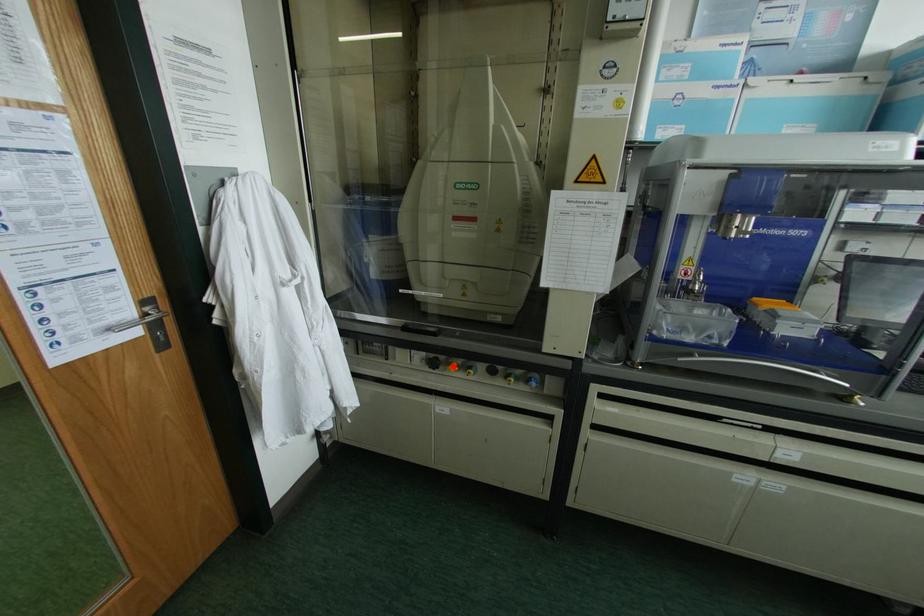
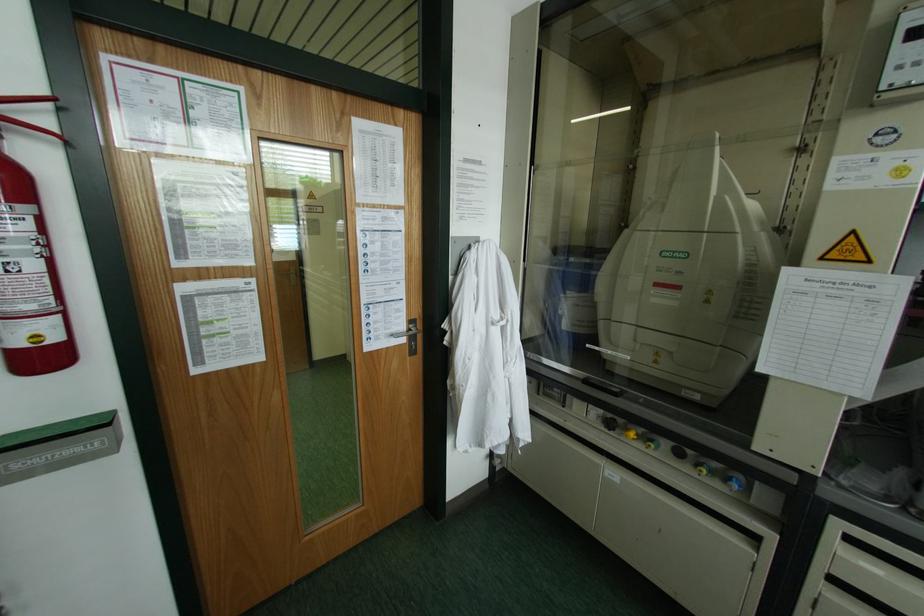
In the second image, find the point that corresponds to the highlighted location in the first image.

(631, 434)